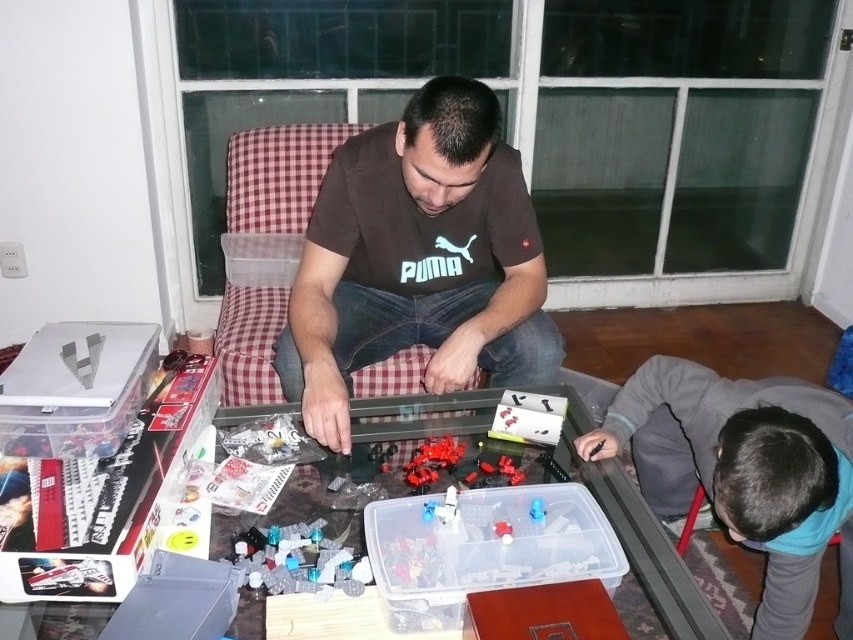
Question: Which object appears closest to the camera in this image?

Choices:
 (A) brown cotton shirt at center
 (B) gray fleece jacket at lower right
 (C) translucent plastic pieces at lower left

Answer: (B)

Question: Which of the following is the closest to the observer?

Choices:
 (A) (438, 122)
 (B) (318, 532)

Answer: (B)

Question: Does brown cotton shirt at center have a lesser width compared to gray fleece jacket at lower right?

Choices:
 (A) yes
 (B) no

Answer: (B)

Question: Does brown cotton shirt at center appear on the left side of gray fleece jacket at lower right?

Choices:
 (A) yes
 (B) no

Answer: (A)

Question: Which point is closer to the camera?

Choices:
 (A) 314,209
 (B) 263,573

Answer: (B)

Question: Can you confirm if gray fleece jacket at lower right is positioned above translucent plastic pieces at lower left?

Choices:
 (A) yes
 (B) no

Answer: (A)